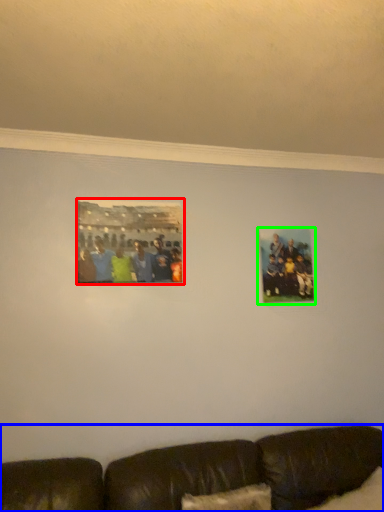
Question: Which object is positioned closest to picture frame (highlighted by a red box)? Select from studio couch (highlighted by a blue box) and picture frame (highlighted by a green box).

Choices:
 (A) studio couch
 (B) picture frame

Answer: (B)